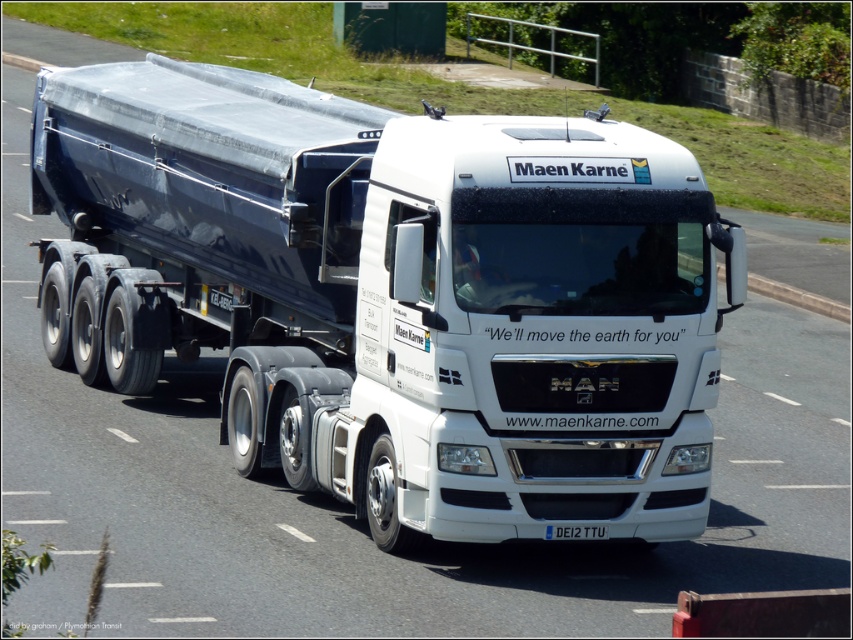
You are a photographer trying to capture the white glossy truck at center and the white plastic license plate at center in a single shot. Which object should you focus on first to ensure both are in frame?

The white glossy truck at center is located above the white plastic license plate at center, so you should focus on the white glossy truck at center first to ensure both are in frame.

Consider the image. You are a photographer trying to capture the white glossy truck at center and the white plastic license plate at center in a single shot. Considering their heights, which one will appear taller in your photo?

The white glossy truck at center has a greater height compared to the white plastic license plate at center, so it will appear taller in the photo.

You are a photographer trying to capture a clear image of the white plastic license plate at center while the white glossy truck at center is moving. Considering the truck is moving, which object will be harder to focus on and why?

The white glossy truck at center will be harder to focus on because its width is larger than the white plastic license plate at center, making it more challenging to capture a sharp image while in motion.